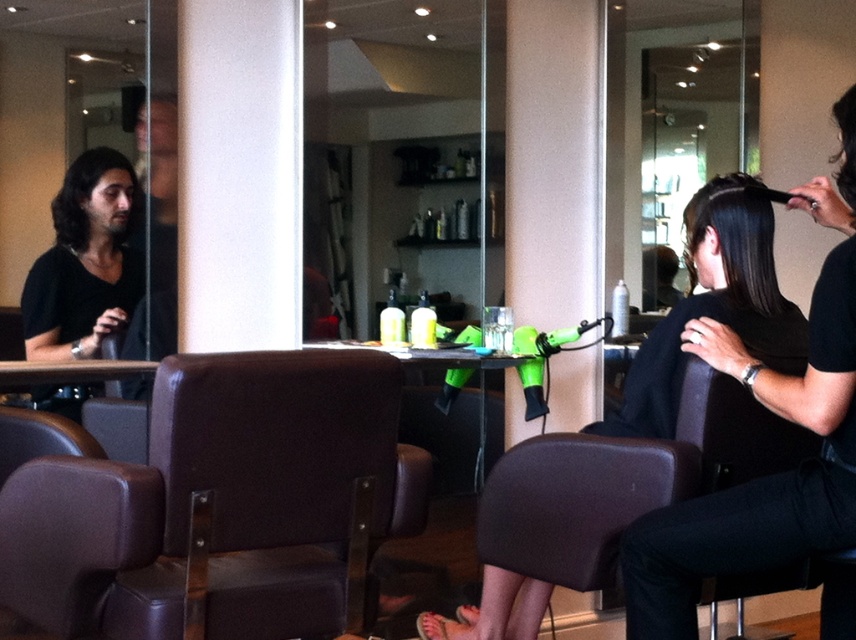
Based on the photo, does matte black shirt at left have a larger size compared to smooth dark brown hair at center?

No, matte black shirt at left is not bigger than smooth dark brown hair at center.

Between point (122, 161) and point (742, 198), which one is positioned in front?

Point (742, 198) is more forward.

Between point (30, 289) and point (717, 232), which one is positioned behind?

Positioned behind is point (30, 289).

Find the location of `matte black shirt at left`. matte black shirt at left is located at coordinates (84, 262).

Does brown leather chair at center appear under matte black shirt at left?

Yes, brown leather chair at center is below matte black shirt at left.

Does brown leather chair at center have a lesser width compared to matte black shirt at left?

Incorrect, brown leather chair at center's width is not less than matte black shirt at left's.

Is point (333, 616) positioned before point (107, 312)?

Yes, it is in front of point (107, 312).

Image resolution: width=856 pixels, height=640 pixels. I want to click on brown leather chair at center, so click(x=223, y=502).

Does point (807, 506) lie behind point (78, 218)?

No, it is not.

Which is behind, point (834, 392) or point (116, 164)?

Point (116, 164)

The height and width of the screenshot is (640, 856). Identify the location of black matte hairbrush at upper right. (777, 416).